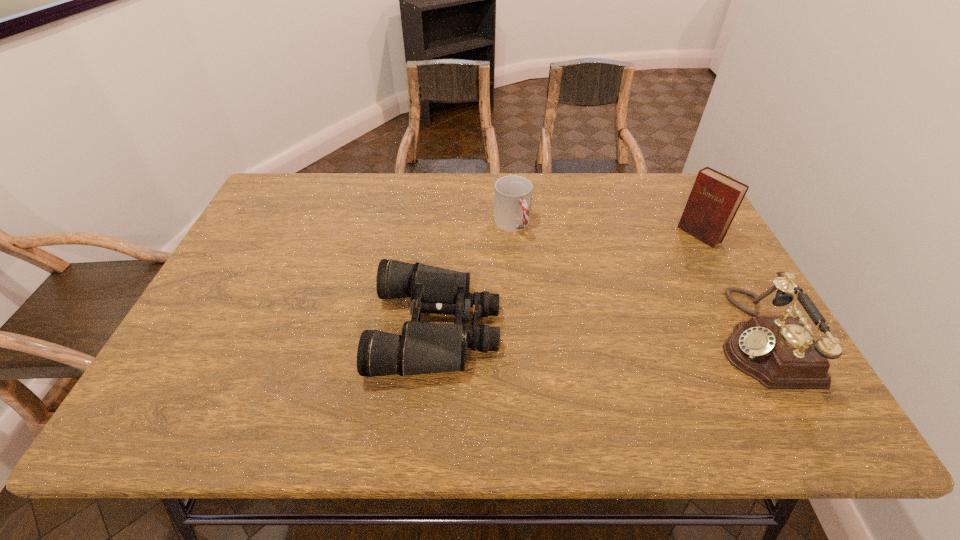
Identify the location of unoccupied area between the binoculars and the telephone. This screenshot has height=540, width=960. (597, 333).

Image resolution: width=960 pixels, height=540 pixels. I want to click on vacant space in between the binoculars and the telephone, so click(597, 333).

Identify the location of blank region between the second shortest object and the telephone. This screenshot has height=540, width=960. (635, 281).

Locate an element on the screen. free area in between the binoculars and the diary is located at coordinates (568, 281).

Find the location of a particular element. Image resolution: width=960 pixels, height=540 pixels. vacant area between the diary and the telephone is located at coordinates (729, 286).

Identify the location of blank region between the shortest object and the second shortest object. (474, 276).

The image size is (960, 540). I want to click on free point between the telephone and the shortest object, so click(x=597, y=333).

You are a GUI agent. You are given a task and a screenshot of the screen. Output one action in this format:
    pyautogui.click(x=<x>, y=<y>)
    Task: Click on the object that is the second closest to the binoculars
    This screenshot has height=540, width=960.
    Given the screenshot: What is the action you would take?
    pyautogui.click(x=779, y=352)

Choose which object is the third nearest neighbor to the telephone. Please provide its 2D coordinates. Your answer should be formatted as a tuple, i.e. [(x, y)], where the tuple contains the x and y coordinates of a point satisfying the conditions above.

[(423, 348)]

What are the coordinates of `vacant space that satisfies the following two spatial constraints: 1. on the front side of the telephone; 2. on the dial of the diary` in the screenshot? It's located at (756, 338).